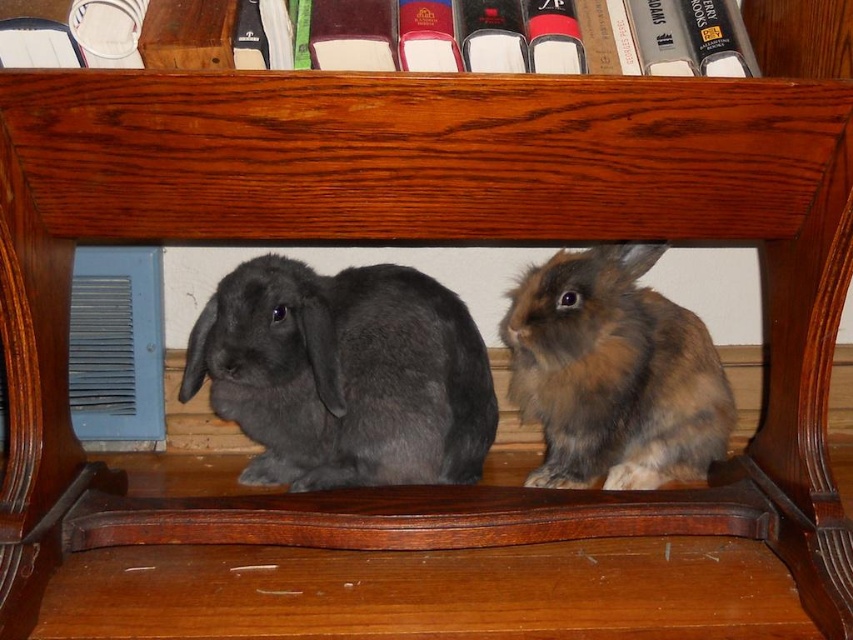
You are a photographer trying to capture a closeup shot of both rabbits. You have a camera that can only focus on one rabbit at a time. If you want to focus on the matte gray rabbit at center first, which direction should you move your camera to then focus on the brown fluffy rabbit at center?

Since the matte gray rabbit at center is to the left of the brown fluffy rabbit at center, you should move your camera to the right to focus on the brown fluffy rabbit at center after focusing on the matte gray rabbit at center.

You are a photographer trying to capture the matte gray rabbit at center. The camera is placed at the origin point. The rabbit is located at point [344,374]. What direction should you move the camera to get a better shot of the rabbit?

The point [344,374] indicates the matte gray rabbit at center, so moving the camera towards that coordinate would center the rabbit in the frame.